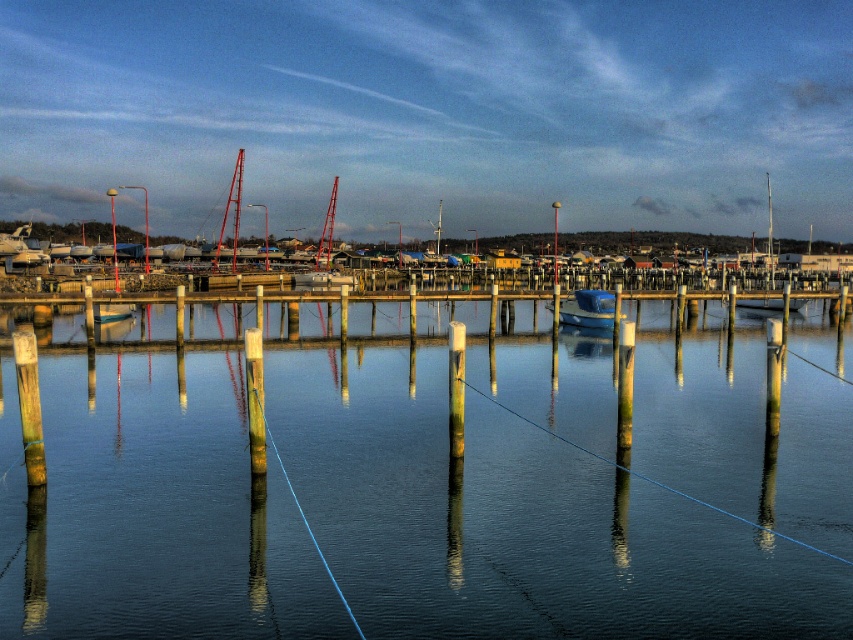
Is transparent water at center bigger than metallic red mast at center?

No.

Can you confirm if transparent water at center is positioned to the right of metallic red mast at center?

Correct, you'll find transparent water at center to the right of metallic red mast at center.

Who is more forward, (x=773, y=458) or (x=218, y=243)?

Point (x=773, y=458) is in front.

At what (x,y) coordinates should I click in order to perform the action: click on transparent water at center. Please return your answer as a coordinate pair (x, y). This screenshot has height=640, width=853. Looking at the image, I should click on click(x=572, y=490).

In the scene shown: Can you confirm if red metallic mast at center is positioned to the right of metallic pole at center?

Indeed, red metallic mast at center is positioned on the right side of metallic pole at center.

Between point (315, 257) and point (144, 195), which one is positioned behind?

Positioned behind is point (144, 195).

Locate an element on the screen. The width and height of the screenshot is (853, 640). red metallic mast at center is located at coordinates (328, 232).

Is point (460, 410) less distant than point (230, 198)?

Yes, point (460, 410) is closer to viewer.

The width and height of the screenshot is (853, 640). I want to click on green wood post at center, so click(456, 387).